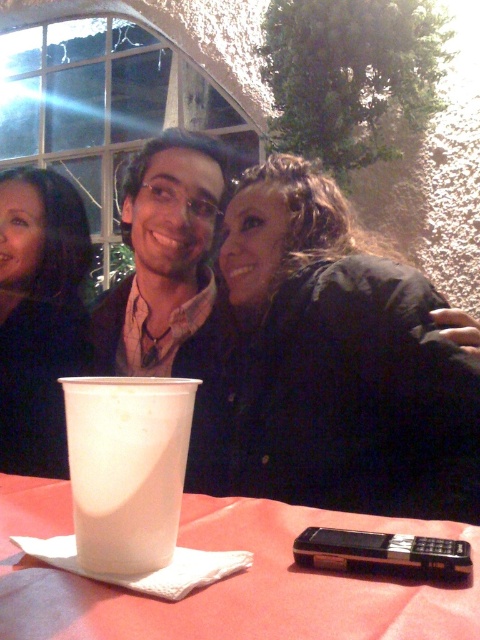
You are standing at the edge of the table and want to place a black matte jacket at center on the table. Where should you place it?

The black matte jacket at center should be placed at the coordinates point (x=337, y=362).

You are a photographer trying to capture a closeup of both the black matte jacket at center and the matte black shirt at center in the scene. Given the camera you have can only focus clearly on objects within a 10 inch range, will you be able to get both in focus at the same time?

The black matte jacket at center is 11.87 inches from the matte black shirt at center. Since the distance between them exceeds the camera focus range of 10 inches, you cannot get both in focus simultaneously.